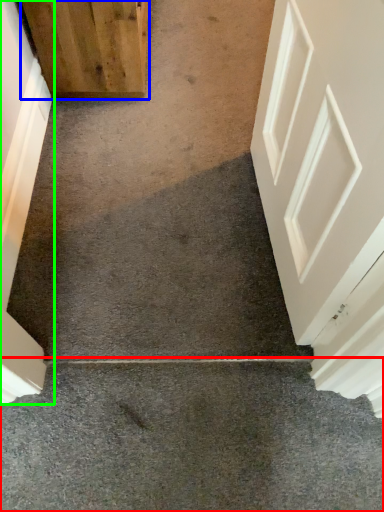
Question: Estimate the real-world distances between objects in this image. Which object is farther from concrete (highlighted by a red box), door (highlighted by a blue box) or door (highlighted by a green box)?

Choices:
 (A) door
 (B) door

Answer: (A)